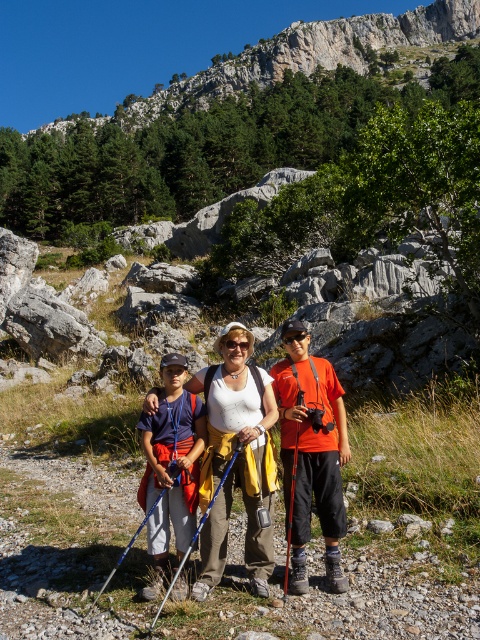
Which is more to the left, matte white tank top at center or blue fabric shirt at center?

From the viewer's perspective, blue fabric shirt at center appears more on the left side.

Which is below, matte white tank top at center or blue fabric shirt at center?

blue fabric shirt at center is below.

At what (x,y) coordinates should I click in order to perform the action: click on matte white tank top at center. Please return your answer as a coordinate pair (x, y). Image resolution: width=480 pixels, height=640 pixels. Looking at the image, I should click on (240, 440).

Looking at this image, who is taller, orange matte shirt at center or blue fabric shirt at center?

Standing taller between the two is orange matte shirt at center.

Is the position of orange matte shirt at center more distant than that of blue fabric shirt at center?

That is True.

The height and width of the screenshot is (640, 480). Find the location of `orange matte shirt at center`. orange matte shirt at center is located at coordinates (311, 451).

Where is `orange matte shirt at center`? The image size is (480, 640). orange matte shirt at center is located at coordinates [311, 451].

Does rocky cliff at upper center come in front of matte white tank top at center?

No, it is behind matte white tank top at center.

The image size is (480, 640). What do you see at coordinates (311, 52) in the screenshot?
I see `rocky cliff at upper center` at bounding box center [311, 52].

The width and height of the screenshot is (480, 640). I want to click on rocky cliff at upper center, so click(x=311, y=52).